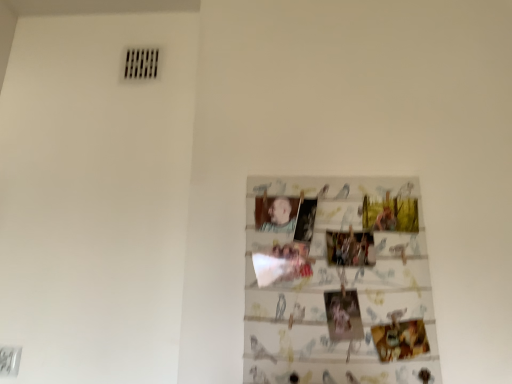
Question: Can you confirm if smooth skin portrait at center is shorter than printed paper collage at center?

Choices:
 (A) yes
 (B) no

Answer: (A)

Question: Is the position of smooth skin portrait at center less distant than that of printed paper collage at center?

Choices:
 (A) no
 (B) yes

Answer: (A)

Question: Is smooth skin portrait at center taller than printed paper collage at center?

Choices:
 (A) yes
 (B) no

Answer: (B)

Question: Is smooth skin portrait at center in contact with printed paper collage at center?

Choices:
 (A) no
 (B) yes

Answer: (A)

Question: Considering the relative sizes of smooth skin portrait at center and printed paper collage at center in the image provided, is smooth skin portrait at center thinner than printed paper collage at center?

Choices:
 (A) yes
 (B) no

Answer: (A)

Question: Is printed paper collage at center a part of smooth skin portrait at center?

Choices:
 (A) no
 (B) yes

Answer: (A)

Question: Does printed paper collage at center have a greater width compared to smooth skin portrait at center?

Choices:
 (A) yes
 (B) no

Answer: (A)

Question: Can you confirm if printed paper collage at center is bigger than smooth skin portrait at center?

Choices:
 (A) yes
 (B) no

Answer: (A)

Question: Considering the relative sizes of printed paper collage at center and smooth skin portrait at center in the image provided, is printed paper collage at center smaller than smooth skin portrait at center?

Choices:
 (A) no
 (B) yes

Answer: (A)

Question: Is printed paper collage at center far from smooth skin portrait at center?

Choices:
 (A) yes
 (B) no

Answer: (B)

Question: From a real-world perspective, is printed paper collage at center located higher than smooth skin portrait at center?

Choices:
 (A) yes
 (B) no

Answer: (B)

Question: Is printed paper collage at center oriented away from smooth skin portrait at center?

Choices:
 (A) yes
 (B) no

Answer: (A)

Question: Is printed paper collage at center in front of or behind smooth skin portrait at center in the image?

Choices:
 (A) front
 (B) behind

Answer: (A)